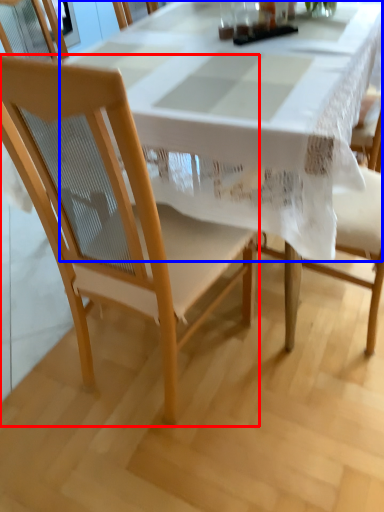
Question: Which point is further to the camera, chair (highlighted by a red box) or tablecloth (highlighted by a blue box)?

Choices:
 (A) chair
 (B) tablecloth

Answer: (B)